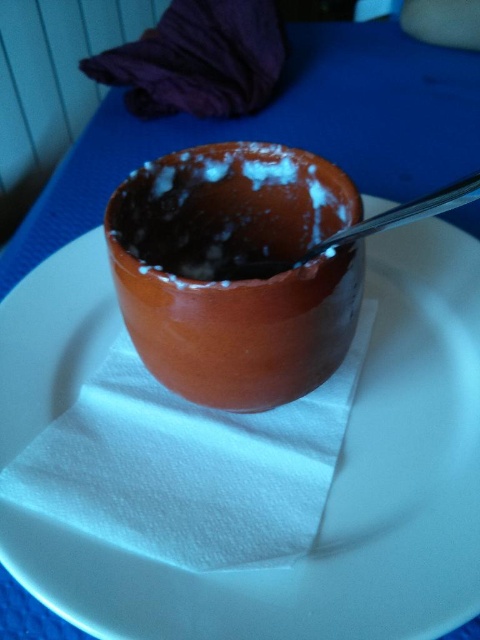
You are setting up a table for a dessert tasting event. You have a brown matte bowl at center and a satin silver spoon at upper center. According to the image, which object is closer to the viewer?

The brown matte bowl at center is closer to the viewer because the satin silver spoon at upper center is positioned behind it.

From the picture: You are a chef inspecting the setup of a dessert display. You notice the purple fabric at upper left and the satin silver spoon at upper center. Which object is positioned higher in the image?

The purple fabric at upper left is above the satin silver spoon at upper center, so it is positioned higher in the image.

You are looking at the image of the dessert setup. There are two points marked in the image. Which point, point (202, 77) or point (464, 193), is closer to you?

Point (202, 77) is closer to you than point (464, 193).